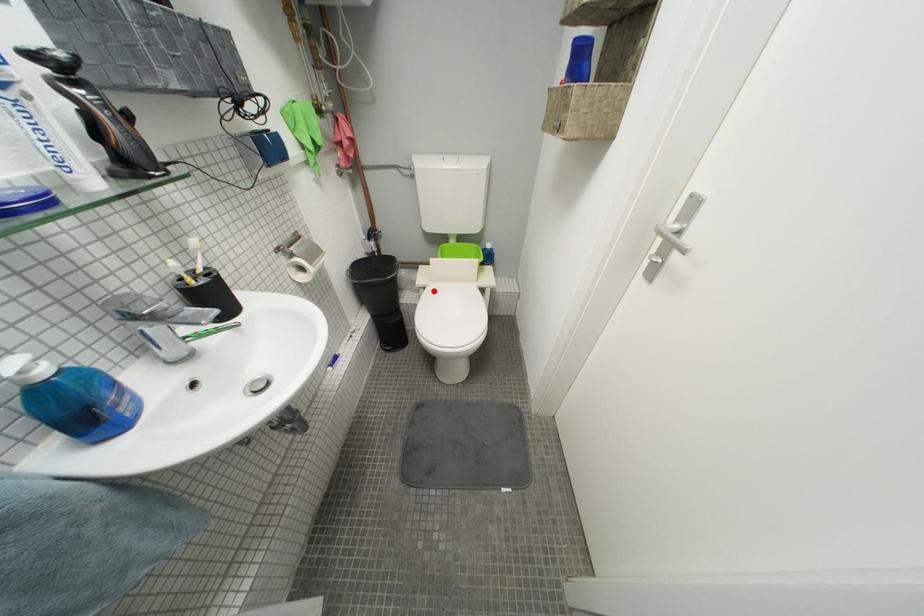
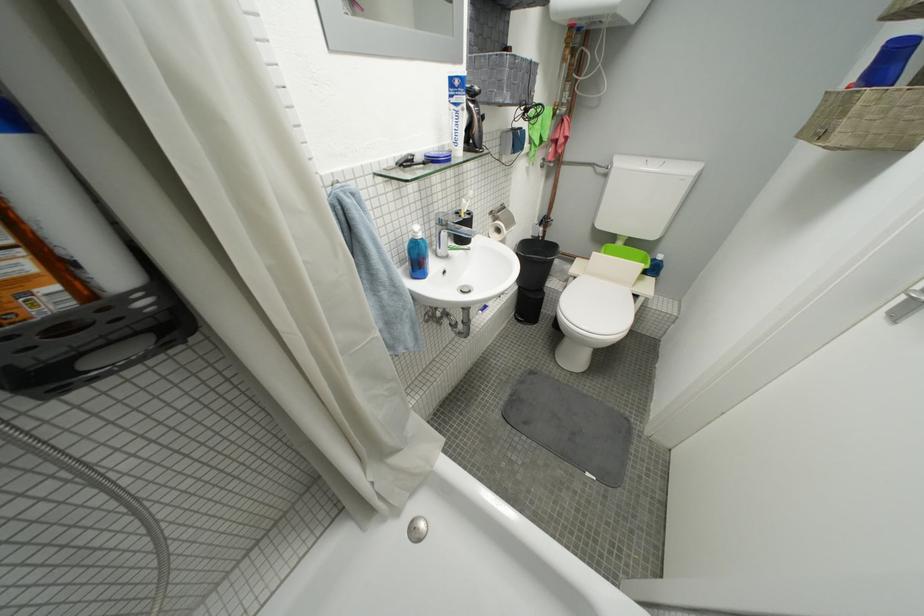
Question: I am providing you with two images of the same scene from different viewpoints. A red point is marked on the first image. At the location where the point appears in image 1, is it still visible in image 2?

Choices:
 (A) Yes
 (B) No

Answer: (A)